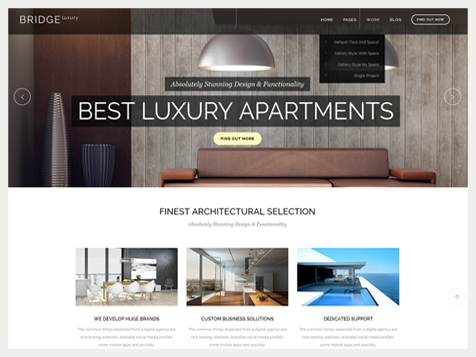
Where is `light shade for ceiling light in background image`? The image size is (476, 357). light shade for ceiling light in background image is located at coordinates (240, 45), (389, 54).